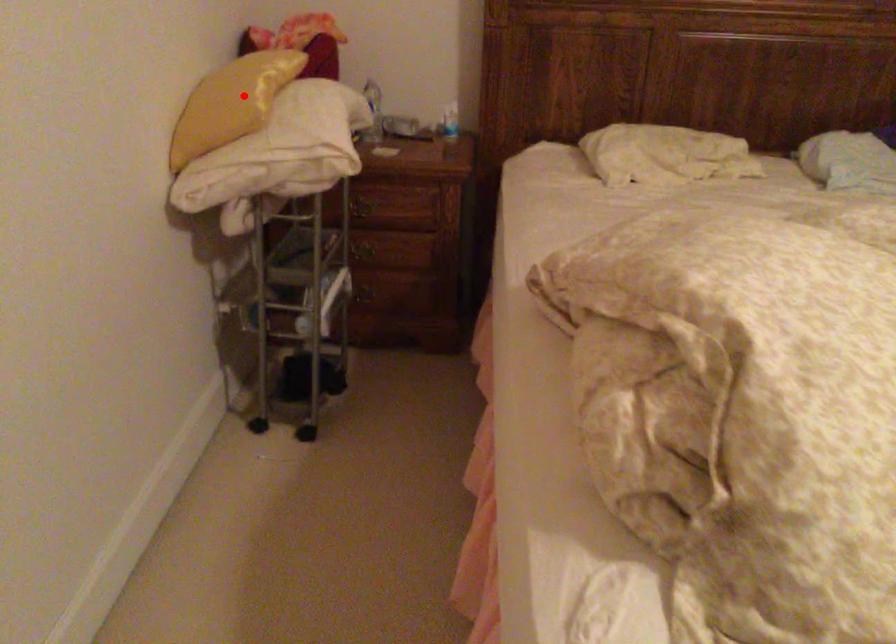
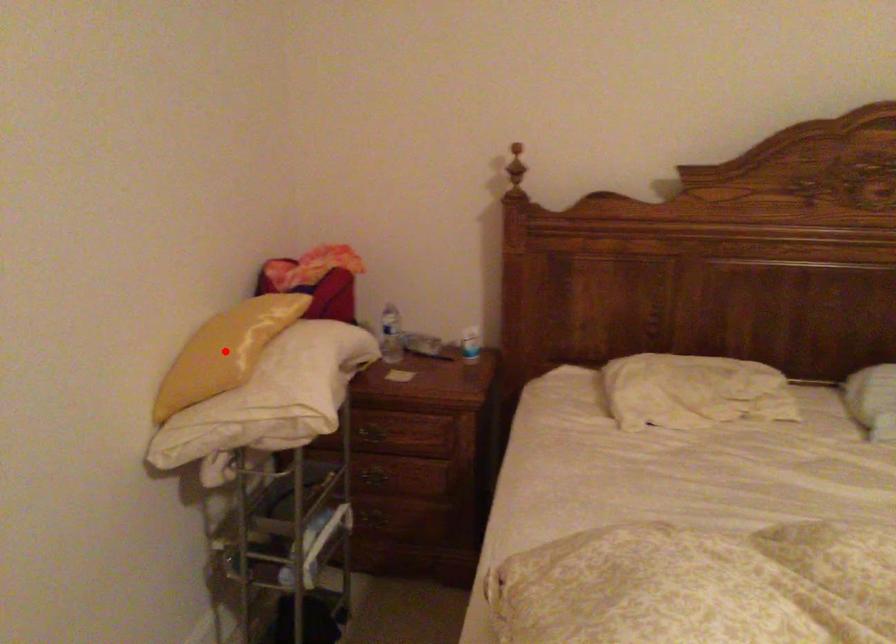
I am providing you with two images of the same scene from different viewpoints. A red point is marked on the first image and another point is marked on the second image. Is the marked point in image1 the same physical position as the marked point in image2?

Yes